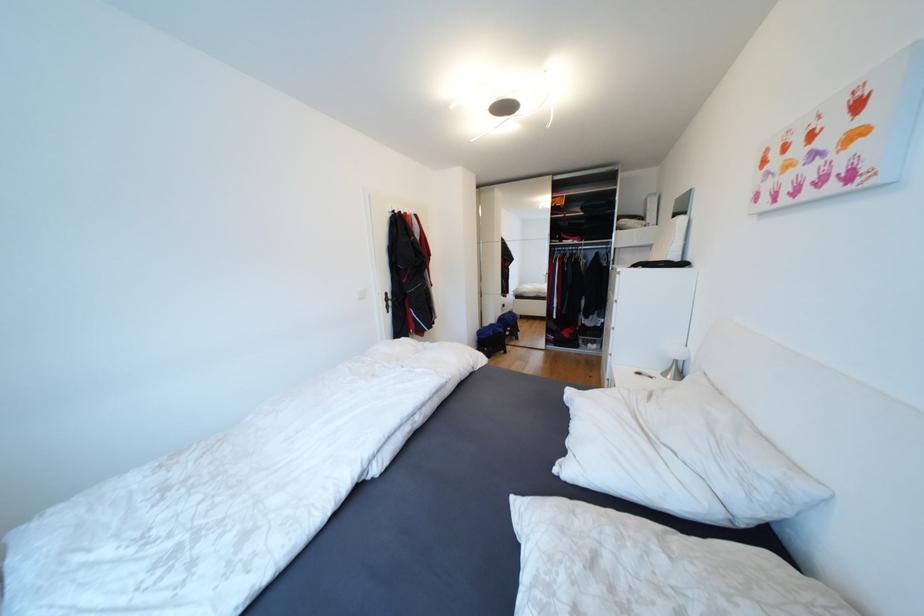
The height and width of the screenshot is (616, 924). What do you see at coordinates (682, 455) in the screenshot?
I see `a white pillow` at bounding box center [682, 455].